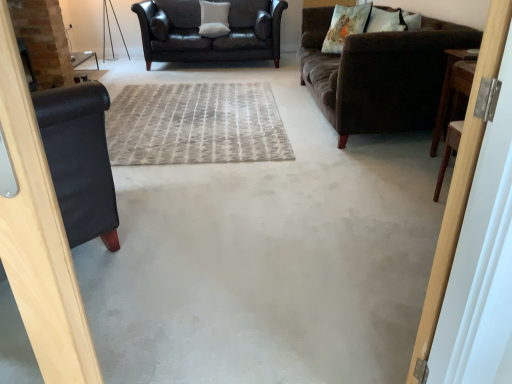
Describe the element at coordinates (195, 124) in the screenshot. I see `gray textured rug at center` at that location.

Image resolution: width=512 pixels, height=384 pixels. Describe the element at coordinates (379, 74) in the screenshot. I see `brown velvety couch at upper right, placed as the first studio couch when sorted from front to back` at that location.

Measure the distance between point (409, 382) and camera.

The distance of point (409, 382) from camera is 4.07 feet.

Where is `wooden door at right`? The image size is (512, 384). wooden door at right is located at coordinates (460, 183).

Identify the location of gray textured rug at center. (195, 124).

Is fluffy white pillow at upper right, marked as the 3th pillow in a left-to-right arrangement, oriented away from brown velvety couch at upper right, placed as the first studio couch when sorted from front to back?

That's right, fluffy white pillow at upper right, marked as the 3th pillow in a left-to-right arrangement, is facing away from brown velvety couch at upper right, placed as the first studio couch when sorted from front to back.

From a real-world perspective, which is physically above, fluffy white pillow at upper right, the third pillow viewed from the top, or brown velvety couch at upper right, positioned as the 1th studio couch in right-to-left order?

fluffy white pillow at upper right, the third pillow viewed from the top, from a real-world perspective.

Consider the image. Considering the sizes of fluffy white pillow at upper right, the 3th pillow from the back, and brown velvety couch at upper right, positioned as the 1th studio couch in right-to-left order, in the image, is fluffy white pillow at upper right, the 3th pillow from the back, bigger or smaller than brown velvety couch at upper right, positioned as the 1th studio couch in right-to-left order,?

In the image, fluffy white pillow at upper right, the 3th pillow from the back, appears to be smaller than brown velvety couch at upper right, positioned as the 1th studio couch in right-to-left order.

From the image's perspective, who appears lower, brown wooden table at right or brown velvety couch at upper right, positioned as the second studio couch in back-to-front order?

brown wooden table at right.

Would you say brown wooden table at right is to the left or to the right of brown velvety couch at upper right, placed as the second studio couch when sorted from left to right, in the picture?

Clearly, brown wooden table at right is on the right of brown velvety couch at upper right, placed as the second studio couch when sorted from left to right, in the image.

From the picture: From a real-world perspective, which is physically below, brown wooden table at right or brown velvety couch at upper right, placed as the second studio couch when sorted from left to right?

From a 3D spatial view, brown wooden table at right is below.

Is brown wooden table at right wider than brown velvety couch at upper right, positioned as the 1th studio couch in right-to-left order?

A: No, brown wooden table at right is not wider than brown velvety couch at upper right, positioned as the 1th studio couch in right-to-left order.

Which of these two, wooden door at right or fluffy white pillow at upper right, positioned as the first pillow in bottom-to-top order, is thinner?

With smaller width is wooden door at right.

Would you say wooden door at right is to the left or to the right of fluffy white pillow at upper right, marked as the 3th pillow in a left-to-right arrangement, in the picture?

From the image, it's evident that wooden door at right is to the left of fluffy white pillow at upper right, marked as the 3th pillow in a left-to-right arrangement.

Does wooden door at right have a smaller size compared to fluffy white pillow at upper right, the third pillow viewed from the top?

Incorrect, wooden door at right is not smaller in size than fluffy white pillow at upper right, the third pillow viewed from the top.

From the image's perspective, which is above, wooden door at right or fluffy white pillow at upper right, the 3th pillow from the back?

fluffy white pillow at upper right, the 3th pillow from the back, is shown above in the image.

Considering the positions of point (493, 10) and point (210, 37), is point (493, 10) closer or farther from the camera than point (210, 37)?

Point (493, 10).

Does wooden door at right have a lesser width compared to white soft cushion at upper center, which appears as the 1th pillow when viewed from the back?

Yes, wooden door at right is thinner than white soft cushion at upper center, which appears as the 1th pillow when viewed from the back.

How far apart are wooden door at right and white soft cushion at upper center, which is the first pillow from left to right?

wooden door at right is 5.51 meters from white soft cushion at upper center, which is the first pillow from left to right.

Is wooden door at right to the left of white soft cushion at upper center, which ranks as the third pillow in right-to-left order, from the viewer's perspective?

In fact, wooden door at right is to the right of white soft cushion at upper center, which ranks as the third pillow in right-to-left order.

From the image's perspective, which one is positioned higher, leather couch at upper center, the second studio couch positioned from the front, or brown velvety couch at upper right, placed as the first studio couch when sorted from front to back?

leather couch at upper center, the second studio couch positioned from the front.

Is leather couch at upper center, positioned as the first studio couch in left-to-right order, oriented away from brown velvety couch at upper right, positioned as the second studio couch in back-to-front order?

Answer: leather couch at upper center, positioned as the first studio couch in left-to-right order, is not turned away from brown velvety couch at upper right, positioned as the second studio couch in back-to-front order.

Are leather couch at upper center, arranged as the second studio couch when viewed from the right, and brown velvety couch at upper right, placed as the second studio couch when sorted from left to right, located far from each other?

Yes, leather couch at upper center, arranged as the second studio couch when viewed from the right, is far from brown velvety couch at upper right, placed as the second studio couch when sorted from left to right.

From a real-world perspective, is leather couch at upper center, which ranks as the first studio couch in back-to-front order, physically located above or below brown velvety couch at upper right, placed as the first studio couch when sorted from front to back?

In terms of real-world spatial position, leather couch at upper center, which ranks as the first studio couch in back-to-front order, is above brown velvety couch at upper right, placed as the first studio couch when sorted from front to back.

From the image's perspective, between fluffy white pillow at upper right, the 1th pillow when ordered from right to left, and wooden door at right, who is located below?

wooden door at right.

You are a GUI agent. You are given a task and a screenshot of the screen. Output one action in this format:
    pyautogui.click(x=<x>, y=<y>)
    Task: Click on the door that is in front of the fluffy white pillow at upper right, positioned as the first pillow in bottom-to-top order
    
    Given the screenshot: What is the action you would take?
    pyautogui.click(x=460, y=183)

Considering their positions, is fluffy white pillow at upper right, which ranks as the 1th pillow in front-to-back order, located in front of or behind wooden door at right?

In the image, fluffy white pillow at upper right, which ranks as the 1th pillow in front-to-back order, appears behind wooden door at right.

Consider the image. Would you consider fluffy white pillow at upper right, the third pillow viewed from the top, to be distant from wooden door at right?

Yes, fluffy white pillow at upper right, the third pillow viewed from the top, and wooden door at right are quite far apart.

Does floral fabric pillow at upper right, the 2th pillow viewed from the back, come behind brown velvety couch at upper right, positioned as the 1th studio couch in right-to-left order?

Yes, it is behind brown velvety couch at upper right, positioned as the 1th studio couch in right-to-left order.

Choose the correct answer: Is floral fabric pillow at upper right, the second pillow when ordered from bottom to top, inside brown velvety couch at upper right, positioned as the second studio couch in back-to-front order, or outside it?

floral fabric pillow at upper right, the second pillow when ordered from bottom to top, is contained in brown velvety couch at upper right, positioned as the second studio couch in back-to-front order.

Could you measure the distance between floral fabric pillow at upper right, the 2th pillow in the front-to-back sequence, and brown velvety couch at upper right, placed as the first studio couch when sorted from front to back?

floral fabric pillow at upper right, the 2th pillow in the front-to-back sequence, is 19.41 inches away from brown velvety couch at upper right, placed as the first studio couch when sorted from front to back.

Between floral fabric pillow at upper right, the second pillow when ordered from bottom to top, and brown velvety couch at upper right, placed as the first studio couch when sorted from front to back, which one has smaller size?

Smaller between the two is floral fabric pillow at upper right, the second pillow when ordered from bottom to top.

From the fluffy white pillow at upper right, the 1th pillow when ordered from right to left, count the 1st studio couch to the left and point to it. Please provide its 2D coordinates.

[(379, 74)]

From the brown wooden table at right, count 1st studio couchs backward and point to it. Please provide its 2D coordinates.

[(379, 74)]

Which object lies further to the anchor point gray textured rug at center, white soft cushion at upper center, which appears as the 1th pillow when viewed from the back, or fluffy white pillow at upper right, which ranks as the 1th pillow in front-to-back order?

white soft cushion at upper center, which appears as the 1th pillow when viewed from the back, is positioned further to the anchor gray textured rug at center.

Which object lies further to the anchor point floral fabric pillow at upper right, the second pillow viewed from the right, brown velvety couch at upper right, positioned as the 1th studio couch in right-to-left order, or fluffy white pillow at upper right, the 3th pillow from the back?

Among the two, brown velvety couch at upper right, positioned as the 1th studio couch in right-to-left order, is located further to floral fabric pillow at upper right, the second pillow viewed from the right.

Based on their spatial positions, is brown wooden table at right or brown velvety couch at upper right, positioned as the 1th studio couch in right-to-left order, closer to wooden door at right?

Among the two, brown wooden table at right is located nearer to wooden door at right.

From the image, which object appears to be farther from gray textured rug at center, white soft cushion at upper center, which is the 3th pillow in front-to-back order, or leather couch at upper center, positioned as the first studio couch in left-to-right order?

white soft cushion at upper center, which is the 3th pillow in front-to-back order.

From the image, which object appears to be farther from gray textured rug at center, brown wooden table at right or leather couch at upper center, which ranks as the first studio couch in back-to-front order?

leather couch at upper center, which ranks as the first studio couch in back-to-front order, is further to gray textured rug at center.

Looking at the image, which one is located closer to gray textured rug at center, fluffy white pillow at upper right, the 3th pillow from the back, or wooden door at right?

fluffy white pillow at upper right, the 3th pillow from the back, lies closer to gray textured rug at center than the other object.

From the image, which object appears to be farther from white soft cushion at upper center, which appears as the 1th pillow when viewed from the back, floral fabric pillow at upper right, the 2th pillow in the front-to-back sequence, or gray textured rug at center?

gray textured rug at center is further to white soft cushion at upper center, which appears as the 1th pillow when viewed from the back.

Estimate the real-world distances between objects in this image. Which object is closer to brown velvety couch at upper right, placed as the first studio couch when sorted from front to back, gray textured rug at center or leather couch at upper center, the second studio couch positioned from the front?

gray textured rug at center is positioned closer to the anchor brown velvety couch at upper right, placed as the first studio couch when sorted from front to back.

This screenshot has width=512, height=384. Find the location of `table between wooden door at right and leather couch at upper center, arranged as the second studio couch when viewed from the right, from front to back`. table between wooden door at right and leather couch at upper center, arranged as the second studio couch when viewed from the right, from front to back is located at coordinates (448, 91).

The width and height of the screenshot is (512, 384). Identify the location of pillow between brown wooden table at right and floral fabric pillow at upper right, which appears as the second pillow when viewed from the top, from front to back. (385, 21).

Where is `plain between wooden door at right and floral fabric pillow at upper right, which appears as the second pillow when viewed from the top, along the z-axis`? Image resolution: width=512 pixels, height=384 pixels. plain between wooden door at right and floral fabric pillow at upper right, which appears as the second pillow when viewed from the top, along the z-axis is located at coordinates (195, 124).

Where is `studio couch positioned between wooden door at right and fluffy white pillow at upper right, which ranks as the 1th pillow in front-to-back order, from near to far`? Image resolution: width=512 pixels, height=384 pixels. studio couch positioned between wooden door at right and fluffy white pillow at upper right, which ranks as the 1th pillow in front-to-back order, from near to far is located at coordinates (379, 74).